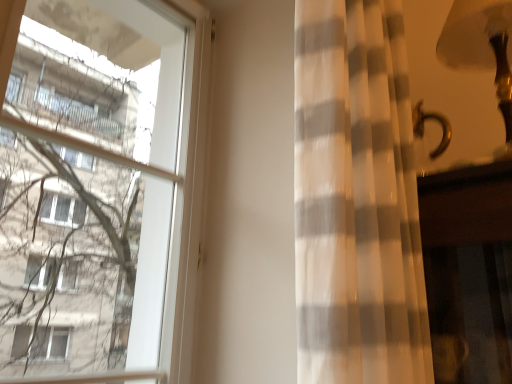
Question: Is gold metallic table lamp at upper right not within white sheer curtain at right?

Choices:
 (A) yes
 (B) no

Answer: (B)

Question: Does gold metallic table lamp at upper right appear on the left side of white sheer curtain at right?

Choices:
 (A) no
 (B) yes

Answer: (A)

Question: Is white sheer curtain at right a part of gold metallic table lamp at upper right?

Choices:
 (A) yes
 (B) no

Answer: (B)

Question: Considering the relative sizes of gold metallic table lamp at upper right and white sheer curtain at right in the image provided, is gold metallic table lamp at upper right taller than white sheer curtain at right?

Choices:
 (A) yes
 (B) no

Answer: (B)

Question: Is gold metallic table lamp at upper right facing away from white sheer curtain at right?

Choices:
 (A) yes
 (B) no

Answer: (B)

Question: In the image, is transparent glass window at left on the left side or the right side of gold metallic table lamp at upper right?

Choices:
 (A) right
 (B) left

Answer: (B)

Question: Is transparent glass window at left in front of or behind gold metallic table lamp at upper right in the image?

Choices:
 (A) behind
 (B) front

Answer: (B)

Question: Choose the correct answer: Is transparent glass window at left inside gold metallic table lamp at upper right or outside it?

Choices:
 (A) outside
 (B) inside

Answer: (A)

Question: Considering the positions of transparent glass window at left and gold metallic table lamp at upper right in the image, is transparent glass window at left bigger or smaller than gold metallic table lamp at upper right?

Choices:
 (A) big
 (B) small

Answer: (A)

Question: Is white sheer curtain at right in front of or behind transparent glass window at left in the image?

Choices:
 (A) behind
 (B) front

Answer: (B)

Question: Which is correct: white sheer curtain at right is inside transparent glass window at left, or outside of it?

Choices:
 (A) outside
 (B) inside

Answer: (A)

Question: In terms of height, does white sheer curtain at right look taller or shorter compared to transparent glass window at left?

Choices:
 (A) tall
 (B) short

Answer: (A)

Question: Is white sheer curtain at right wider or thinner than transparent glass window at left?

Choices:
 (A) thin
 (B) wide

Answer: (B)

Question: Considering the positions of gold metallic table lamp at upper right and transparent glass window at left in the image, is gold metallic table lamp at upper right wider or thinner than transparent glass window at left?

Choices:
 (A) thin
 (B) wide

Answer: (B)

Question: From the image's perspective, is gold metallic table lamp at upper right located above or below transparent glass window at left?

Choices:
 (A) below
 (B) above

Answer: (B)